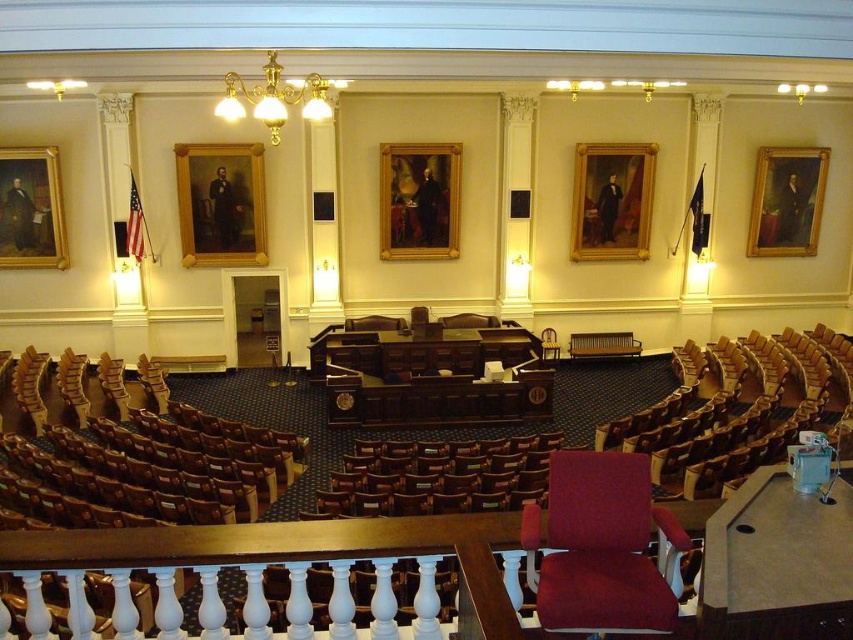
Question: Which object is closer to the camera taking this photo?

Choices:
 (A) gold-framed portrait at upper right
 (B) goldwooden frame at center

Answer: (B)

Question: Is gold-framed portrait at upper right positioned in front of wooden chair at center?

Choices:
 (A) no
 (B) yes

Answer: (A)

Question: Considering the real-world distances, which object is farthest from the goldwooden frame at center?

Choices:
 (A) goldwooden frame at upper center
 (B) wooden seat at center
 (C) gold-framed portrait at left

Answer: (B)

Question: Which object is the farthest from the wooden chair at center?

Choices:
 (A) brown leather chair at left
 (B) brown leather chair at center
 (C) goldwooden frame at center

Answer: (A)

Question: Considering the relative positions of velvet red chair at center and gold-framed portrait at upper right in the image provided, where is velvet red chair at center located with respect to gold-framed portrait at upper right?

Choices:
 (A) right
 (B) left

Answer: (B)

Question: Is wooden seat at center below goldwooden frame at center?

Choices:
 (A) yes
 (B) no

Answer: (A)